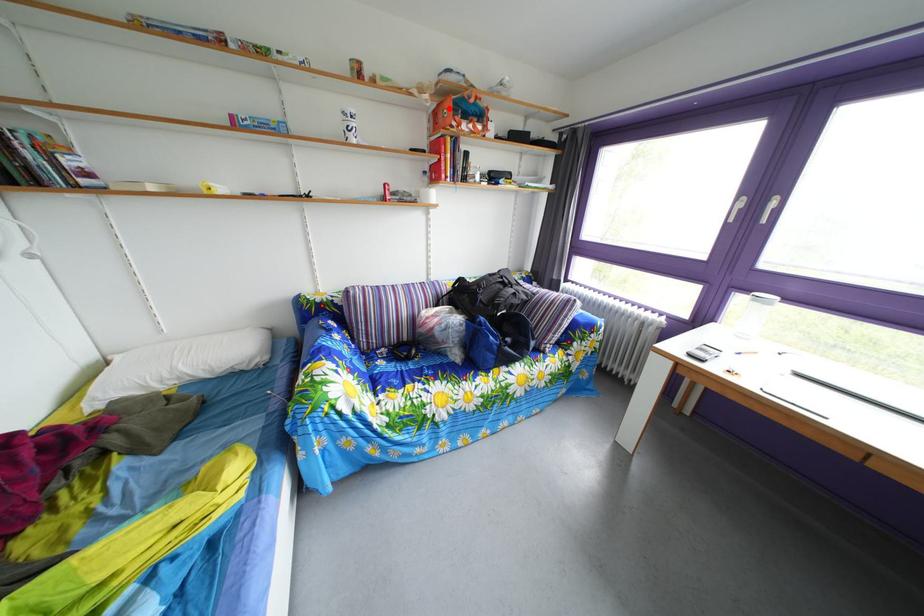
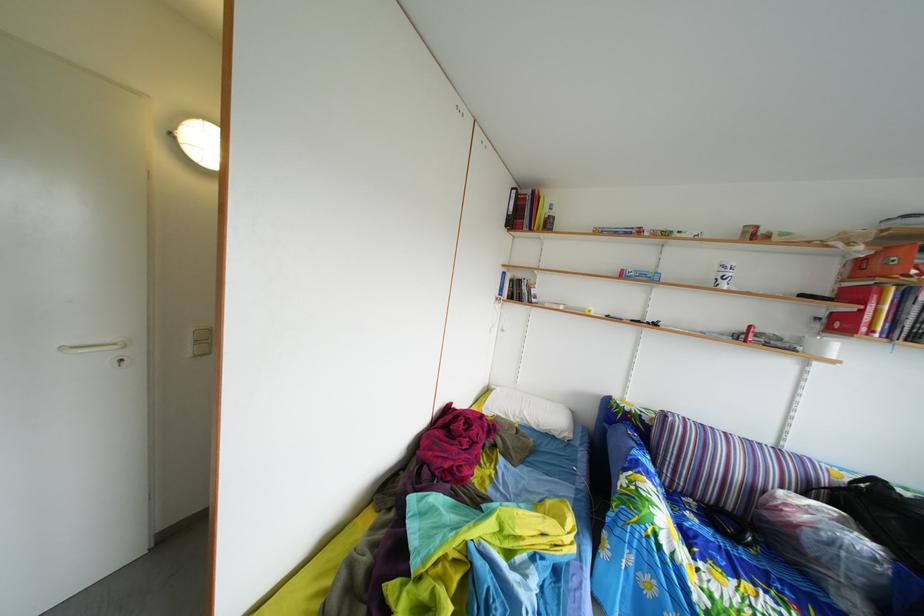
Question: I am providing you with two images of the same scene from different viewpoints. A red point is shown in image1. For the corresponding object point in image2, is it positioned nearer or farther from the camera?

Choices:
 (A) Nearer
 (B) Farther

Answer: (B)